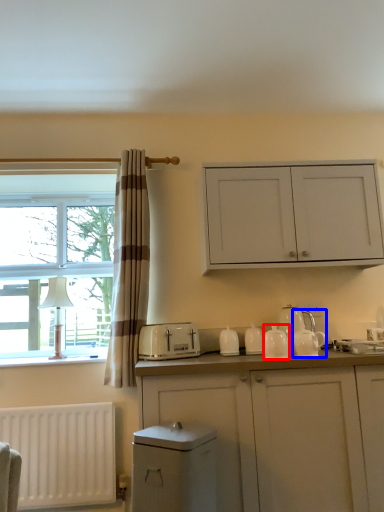
Question: Which point is closer to the camera, tableware (highlighted by a red box) or tea pot (highlighted by a blue box)?

Choices:
 (A) tableware
 (B) tea pot

Answer: (B)